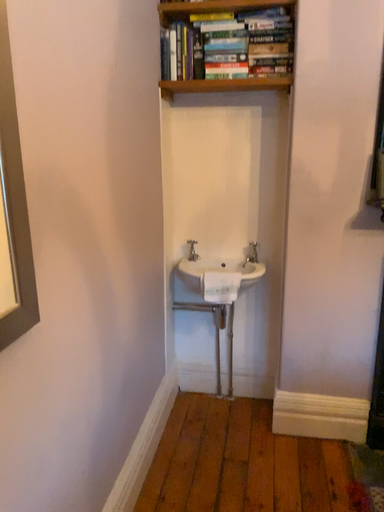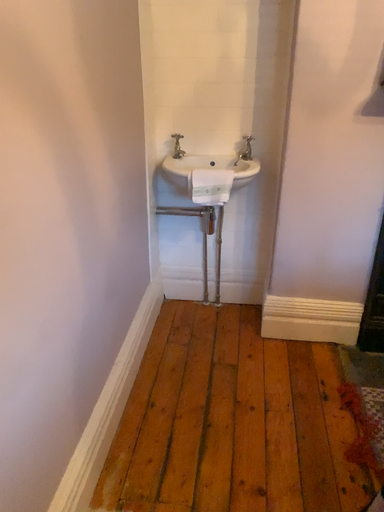
Question: How did the camera likely rotate when shooting the video?

Choices:
 (A) rotated upward
 (B) rotated downward

Answer: (B)